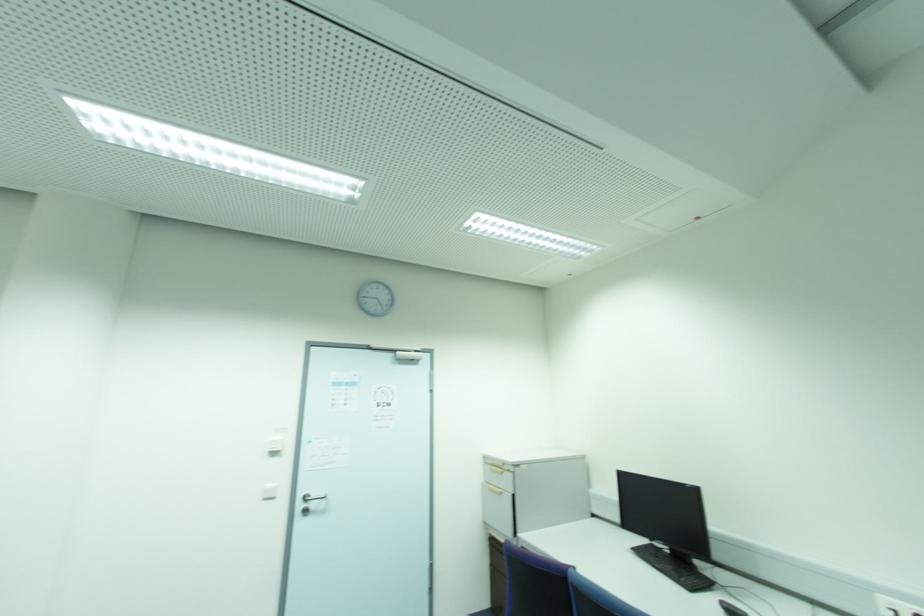
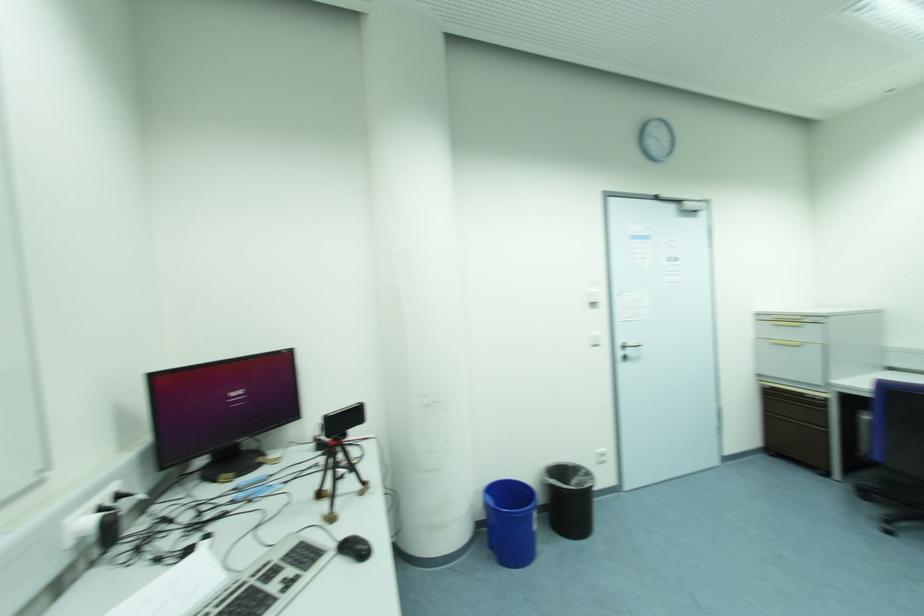
Question: The images are taken continuously from a first-person perspective. In which direction are you moving?

Choices:
 (A) Left
 (B) Right
 (C) Forward
 (D) Backward

Answer: (A)